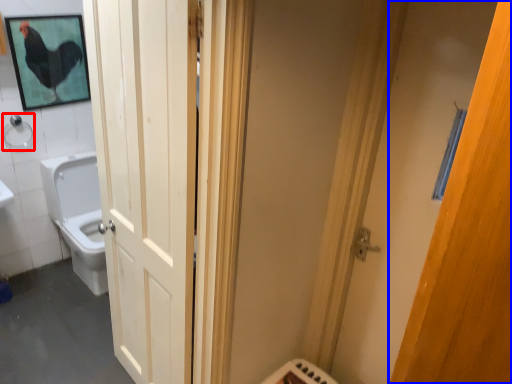
Question: Which object is closer to the camera taking this photo, shower (highlighted by a red box) or door (highlighted by a blue box)?

Choices:
 (A) shower
 (B) door

Answer: (B)